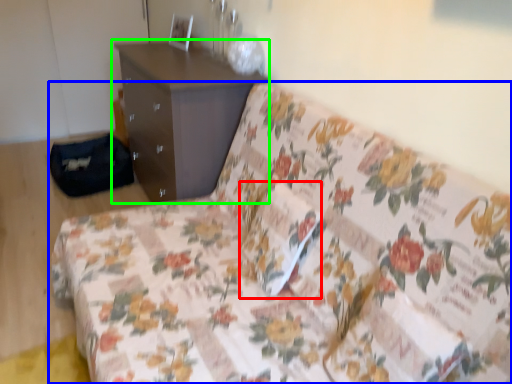
Question: Which is farther away from pillow (highlighted by a red box)? studio couch (highlighted by a blue box) or chest of drawers (highlighted by a green box)?

Choices:
 (A) studio couch
 (B) chest of drawers

Answer: (B)